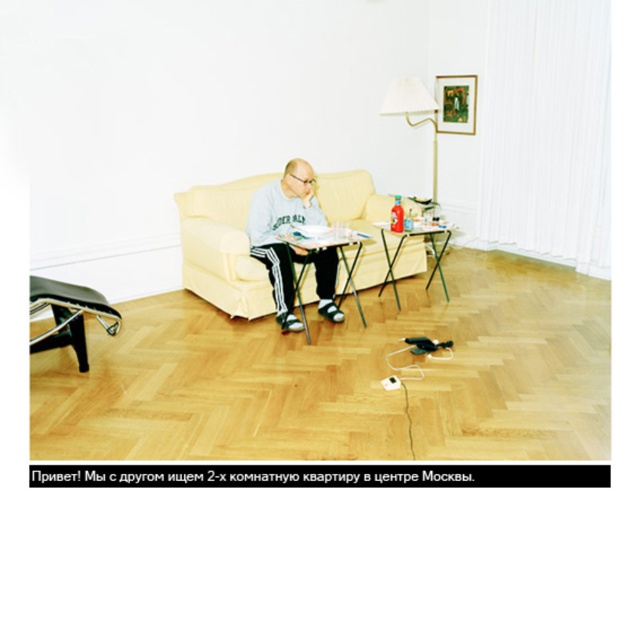
Question: Can you confirm if gray sweatshirt at center is positioned below metallic silver table at center?

Choices:
 (A) yes
 (B) no

Answer: (B)

Question: Which point is farther from the camera taking this photo?

Choices:
 (A) (396, 268)
 (B) (355, 266)
 (C) (426, 109)

Answer: (C)

Question: Which object is positioned farthest from the metallic silver table at center?

Choices:
 (A) white fabric lampshade at upper center
 (B) beige fabric couch at center
 (C) green matte picture frame at upper center
 (D) gray sweatshirt at center

Answer: (C)

Question: Which of these objects is positioned farthest from the gray sweatshirt at center?

Choices:
 (A) white fabric lampshade at upper center
 (B) beige fabric couch at center
 (C) green matte picture frame at upper center

Answer: (C)

Question: Does gray sweatshirt at center have a lesser width compared to metallic silver table at center?

Choices:
 (A) yes
 (B) no

Answer: (B)

Question: Can you confirm if beige fabric couch at center is positioned to the left of green matte picture frame at upper center?

Choices:
 (A) yes
 (B) no

Answer: (A)